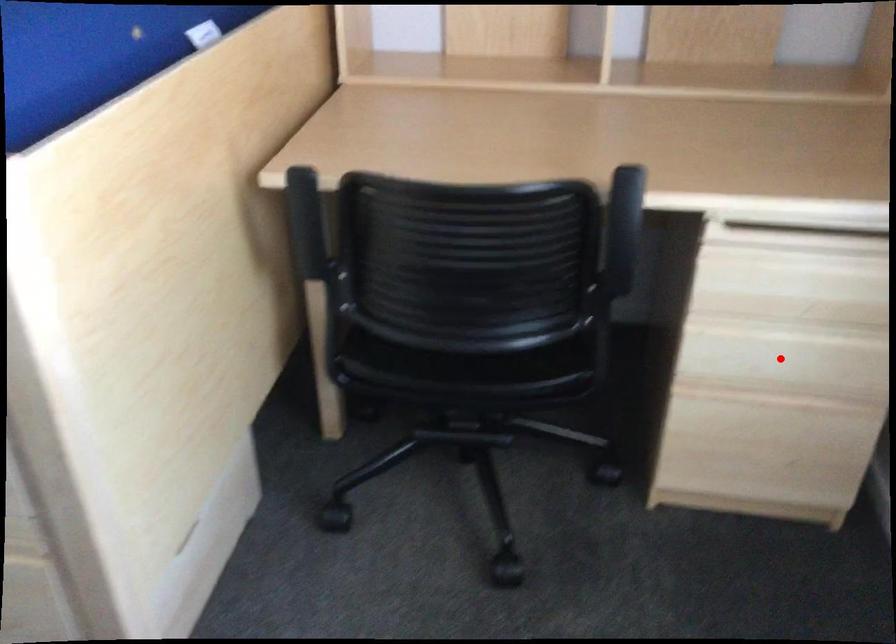
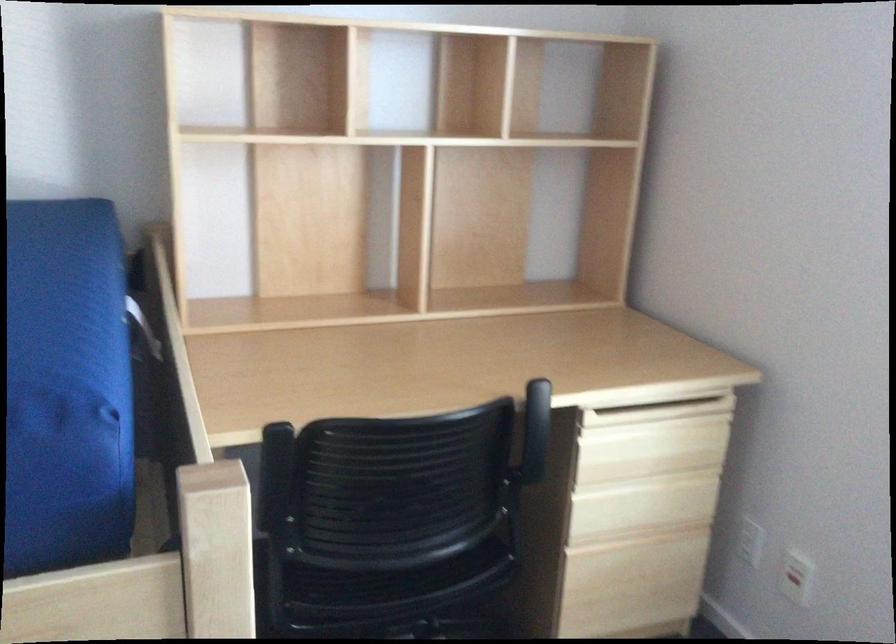
Question: A red point is marked in image1. In image2, is the corresponding 3D point closer to the camera or farther? Reply with the corresponding letter.

Choices:
 (A) The corresponding 3D point is closer.
 (B) The corresponding 3D point is farther.

Answer: (B)